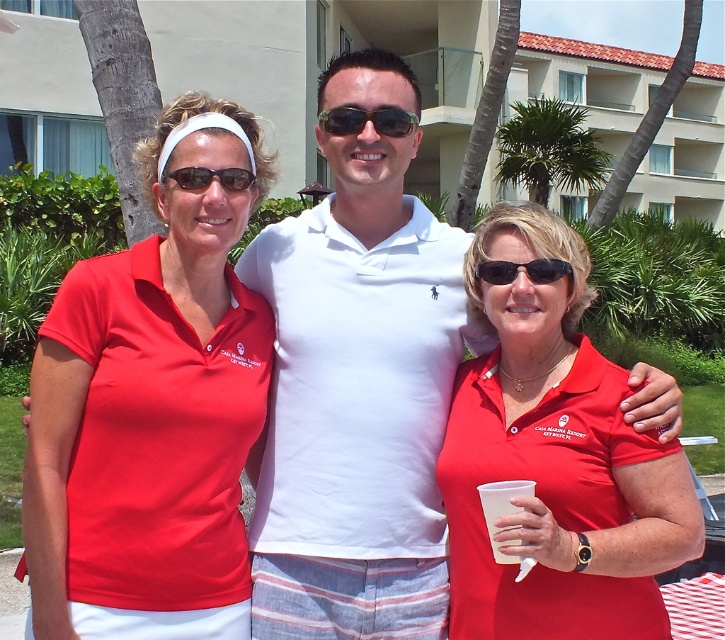
This screenshot has width=725, height=640. Describe the element at coordinates (550, 148) in the screenshot. I see `green leafy palm tree at upper center` at that location.

Is point (542, 196) positioned after point (389, 124)?

Yes, point (542, 196) is farther from viewer.

Image resolution: width=725 pixels, height=640 pixels. Describe the element at coordinates (550, 148) in the screenshot. I see `green leafy palm tree at upper center` at that location.

Locate an element on the screen. This screenshot has height=640, width=725. green leafy palm tree at upper center is located at coordinates (550, 148).

Can you confirm if white cotton polo shirt at center is smaller than shiny black sunglasses at center?

Actually, white cotton polo shirt at center might be larger than shiny black sunglasses at center.

Does point (436, 404) come in front of point (373, 122)?

No, it is behind (373, 122).

Does point (277, 340) come behind point (362, 116)?

Yes, it is behind point (362, 116).

Identify the location of white cotton polo shirt at center. 357,384.

Is point (455, 515) farther from camera compared to point (202, 170)?

Yes, point (455, 515) is farther from viewer.

Is point (515, 408) positioned after point (186, 168)?

Yes, point (515, 408) is farther from viewer.

Identify the location of matte red polo shirt at center. The height and width of the screenshot is (640, 725). [555, 461].